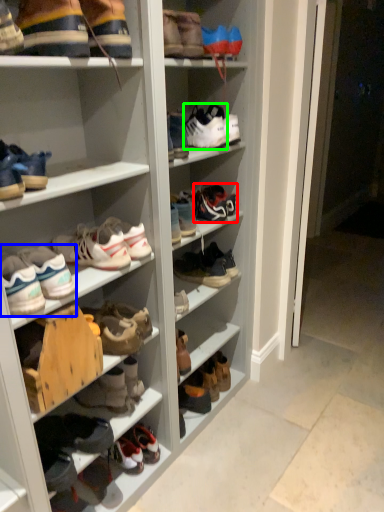
Question: Which is nearer to the footwear (highlighted by a red box)? footwear (highlighted by a blue box) or footwear (highlighted by a green box).

Choices:
 (A) footwear
 (B) footwear

Answer: (B)